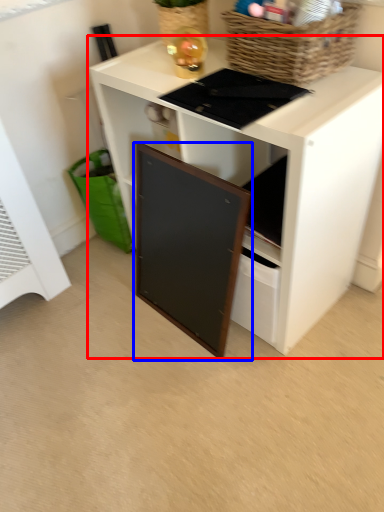
Question: Which object is further to the camera taking this photo, desk (highlighted by a red box) or cabinetry (highlighted by a blue box)?

Choices:
 (A) desk
 (B) cabinetry

Answer: (B)